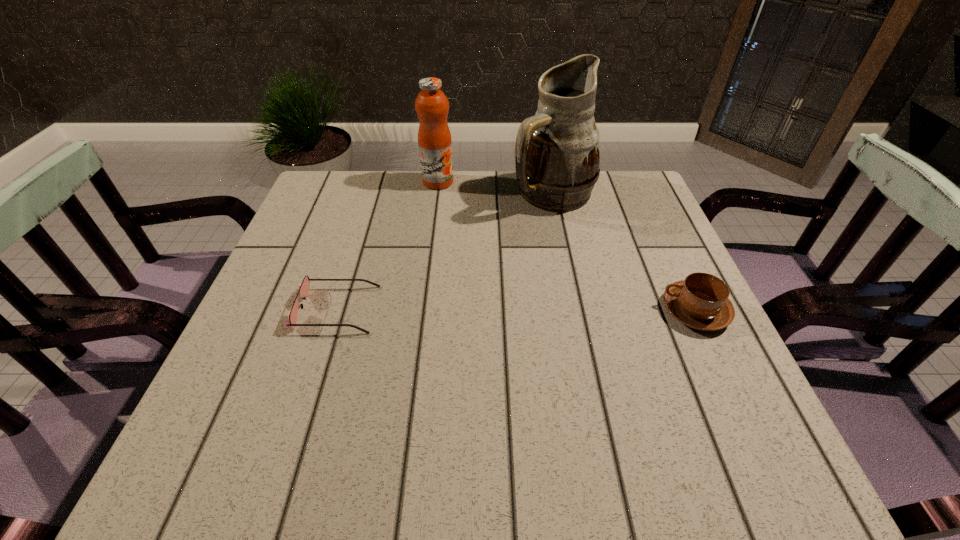
Where is `free space on the desktop that is between the shortest object and the cappuccino and is positioned on the front label of the third shortest object`? The image size is (960, 540). free space on the desktop that is between the shortest object and the cappuccino and is positioned on the front label of the third shortest object is located at coordinates (502, 310).

Find the location of a particular element. Image resolution: width=960 pixels, height=540 pixels. vacant space on the desktop that is between the sunglasses and the rightmost object and is positioned from the spout of the tallest object is located at coordinates (551, 310).